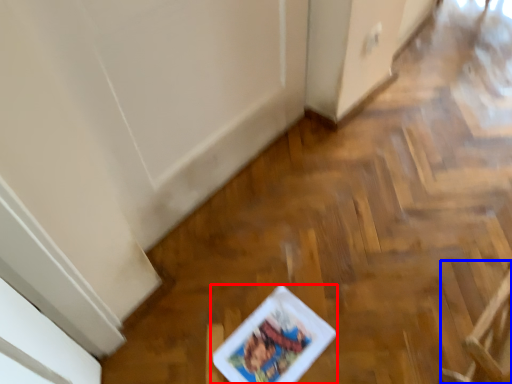
Question: Which object appears closest to the camera in this image, comic book (highlighted by a red box) or armchair (highlighted by a blue box)?

Choices:
 (A) comic book
 (B) armchair

Answer: (B)